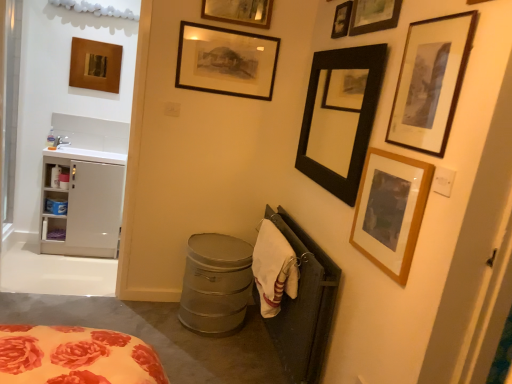
Image resolution: width=512 pixels, height=384 pixels. Identify the location of free point above metallic gray trash can at lower center (from a real-world perspective). (219, 244).